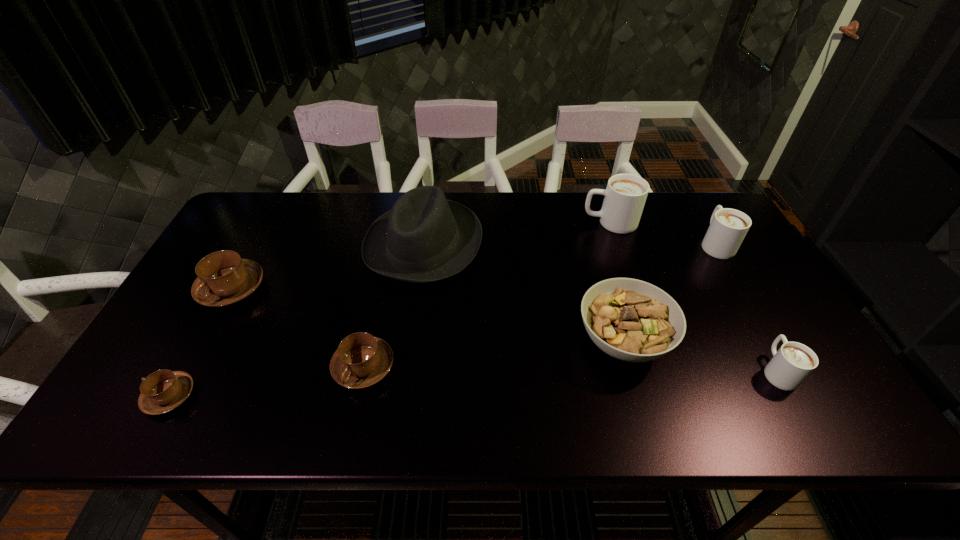
Locate an element on the screen. vacant space situated on the side of the biggest brown cappuccino with the handle is located at coordinates (185, 373).

Locate an element on the screen. The width and height of the screenshot is (960, 540). vacant space located 0.390m on the side with the handle of the smallest white cappuccino is located at coordinates (708, 246).

The image size is (960, 540). Find the location of `vacant space situated 0.070m on the side with the handle of the smallest white cappuccino`. vacant space situated 0.070m on the side with the handle of the smallest white cappuccino is located at coordinates click(x=755, y=328).

Locate an element on the screen. free space located 0.350m on the side with the handle of the smallest white cappuccino is located at coordinates (713, 254).

At what (x,y) coordinates should I click in order to perform the action: click on free space located 0.050m on the side of the shortest object with the handle. Please return your answer as a coordinate pair (x, y). The image size is (960, 540). Looking at the image, I should click on (123, 396).

Find the location of `fedora that is positioned at the far edge`. fedora that is positioned at the far edge is located at coordinates (424, 238).

At what (x,y) coordinates should I click in order to perform the action: click on object at the near edge. Please return your answer as a coordinate pair (x, y). The image size is (960, 540). Looking at the image, I should click on (162, 391).

Image resolution: width=960 pixels, height=540 pixels. Find the location of `object positioned at the near left corner`. object positioned at the near left corner is located at coordinates (162, 391).

Locate an element on the screen. The height and width of the screenshot is (540, 960). object positioned at the far right corner is located at coordinates (728, 227).

In the image, there is a desktop. What are the coordinates of `free region at the far edge` in the screenshot? It's located at (543, 205).